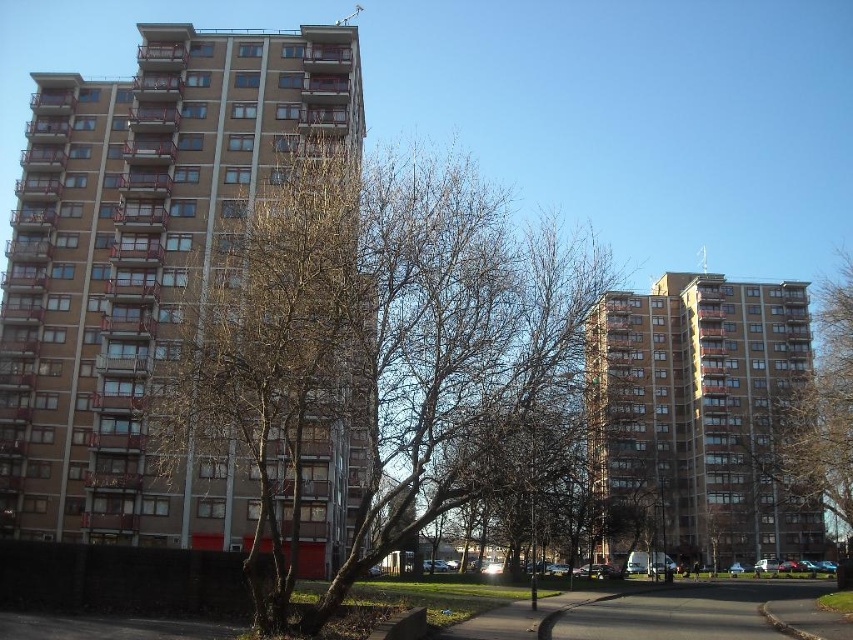
Can you confirm if brown concrete building at center is positioned below bare branches at right?

Yes, brown concrete building at center is below bare branches at right.

Is brown concrete building at center positioned in front of bare branches at right?

Yes, it is in front of bare branches at right.

Who is more forward, (695, 381) or (791, 440)?

Point (791, 440)

Where is `brown concrete building at center`? Image resolution: width=853 pixels, height=640 pixels. brown concrete building at center is located at coordinates (697, 419).

Can you confirm if brown leafless tree at left is positioned above bare branches at center?

Correct, brown leafless tree at left is located above bare branches at center.

Where is `brown leafless tree at left`? The height and width of the screenshot is (640, 853). brown leafless tree at left is located at coordinates (379, 355).

Can you confirm if brown leafless tree at left is shorter than brown concrete building at center?

In fact, brown leafless tree at left may be taller than brown concrete building at center.

Who is taller, brown leafless tree at left or brown concrete building at center?

brown leafless tree at left is taller.

Is point (444, 292) closer to camera compared to point (724, 464)?

Yes.

I want to click on brown leafless tree at left, so click(x=379, y=355).